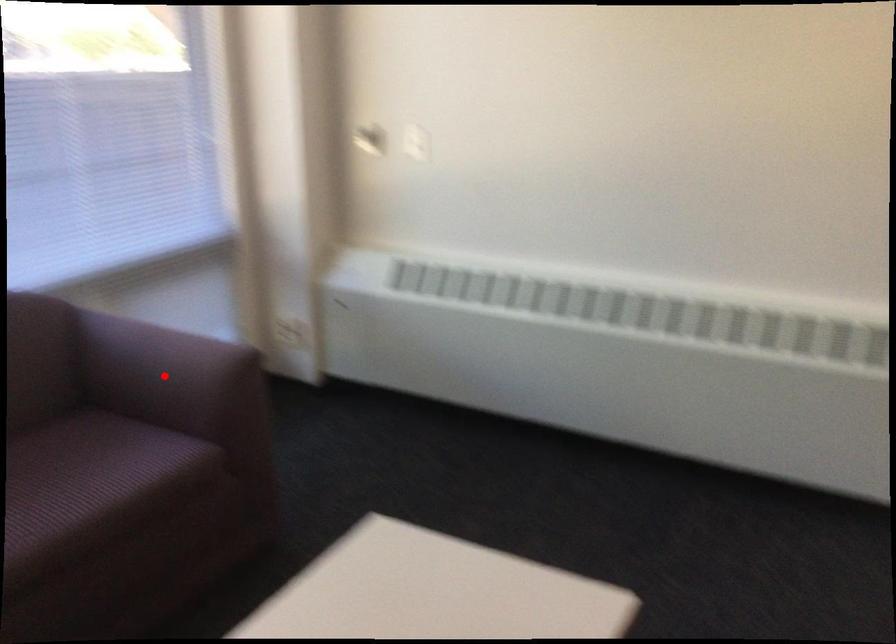
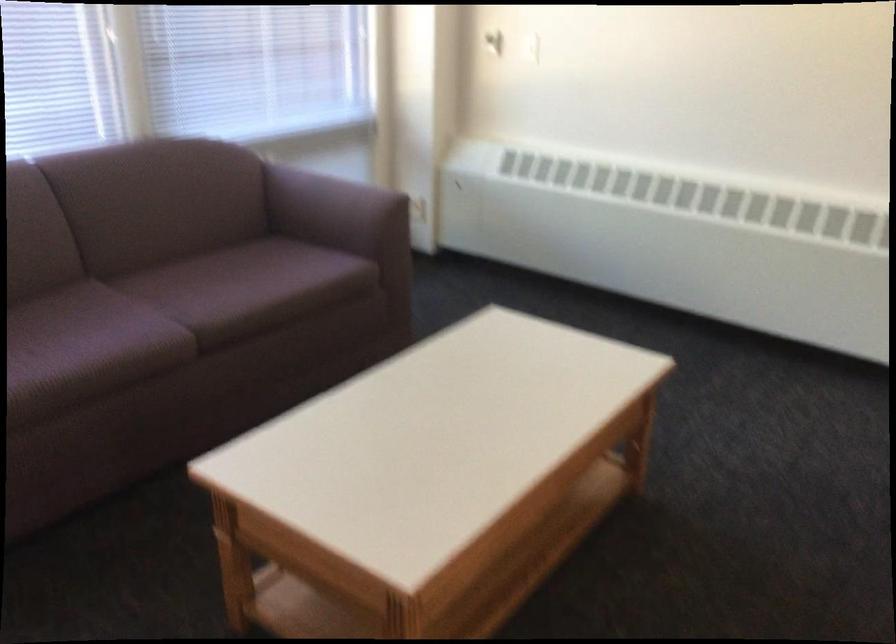
The point at the highlighted location is marked in the first image. Where is the corresponding point in the second image?

(336, 211)